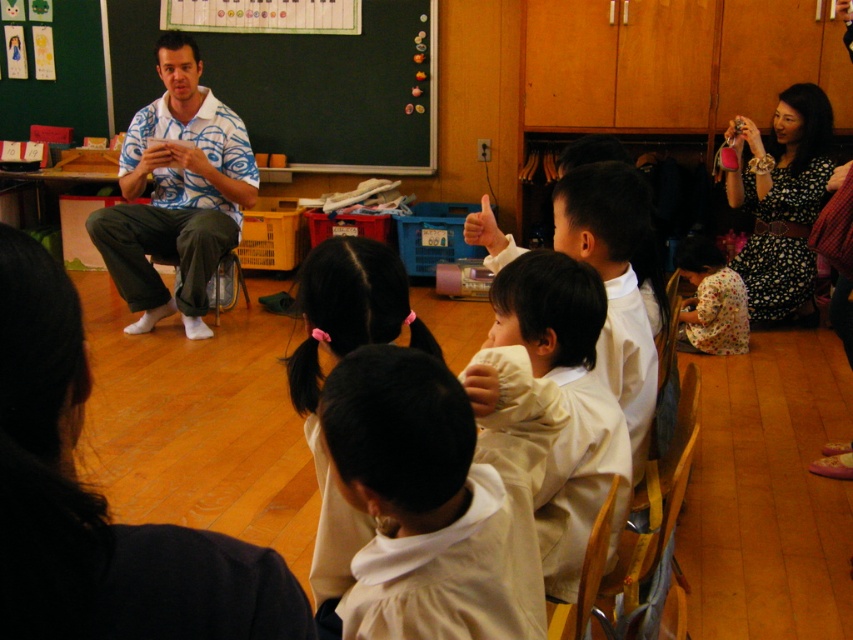
Consider the image. You are standing in the classroom and want to determine which of the two points, point (x=585, y=275) or point (x=700, y=266), is closer to you. Based on the scene description, which point is nearer?

Point (x=585, y=275) is closer to the camera than point (x=700, y=266), so it is the nearer one.

You are a photographer standing at the back of the classroom. You need to take a photo of the white soft shirt at center and the floral fabric dress at lower right so that both are fully visible. Which object should you adjust to ensure the shorter one is not blocked by the taller one?

The white soft shirt at center is shorter than the floral fabric dress at lower right. To ensure both are fully visible, adjust the position of the floral fabric dress at lower right so that it does not block the white soft shirt at center.